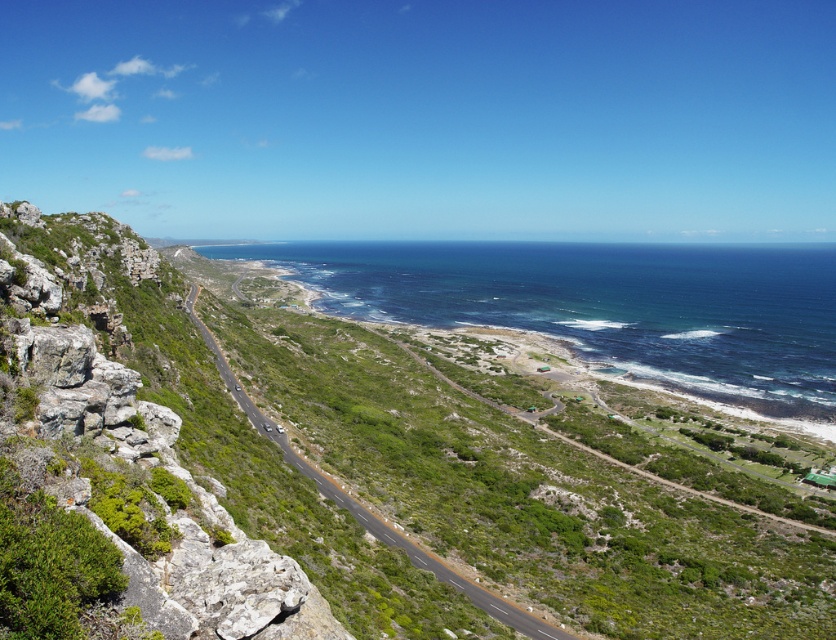
Question: Does green grassy hillside at lower left appear over green grassy road at center?

Choices:
 (A) no
 (B) yes

Answer: (B)

Question: Which object is positioned farthest from the green grassy road at center?

Choices:
 (A) green grassy hillside at lower left
 (B) green mossy rock at left

Answer: (A)

Question: Is green mossy rock at left positioned at the back of green grassy road at center?

Choices:
 (A) no
 (B) yes

Answer: (A)

Question: Which of the following is the closest to the observer?

Choices:
 (A) (457, 588)
 (B) (817, 556)

Answer: (A)

Question: Does green mossy rock at left come in front of green grassy road at center?

Choices:
 (A) no
 (B) yes

Answer: (B)

Question: Among these objects, which one is farthest from the camera?

Choices:
 (A) green grassy hillside at lower left
 (B) green grassy road at center
 (C) green mossy rock at left

Answer: (B)